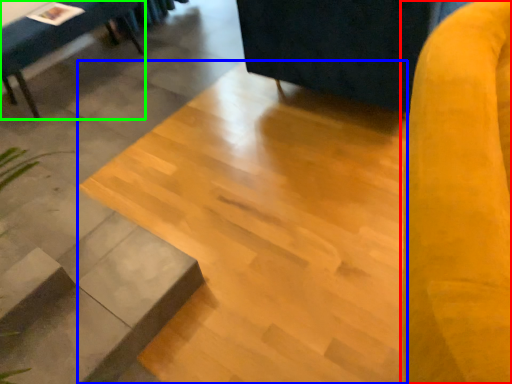
Question: Estimate the real-world distances between objects in this image. Which object is farther from swivel chair (highlighted by a red box), concrete (highlighted by a blue box) or furniture (highlighted by a green box)?

Choices:
 (A) concrete
 (B) furniture

Answer: (B)